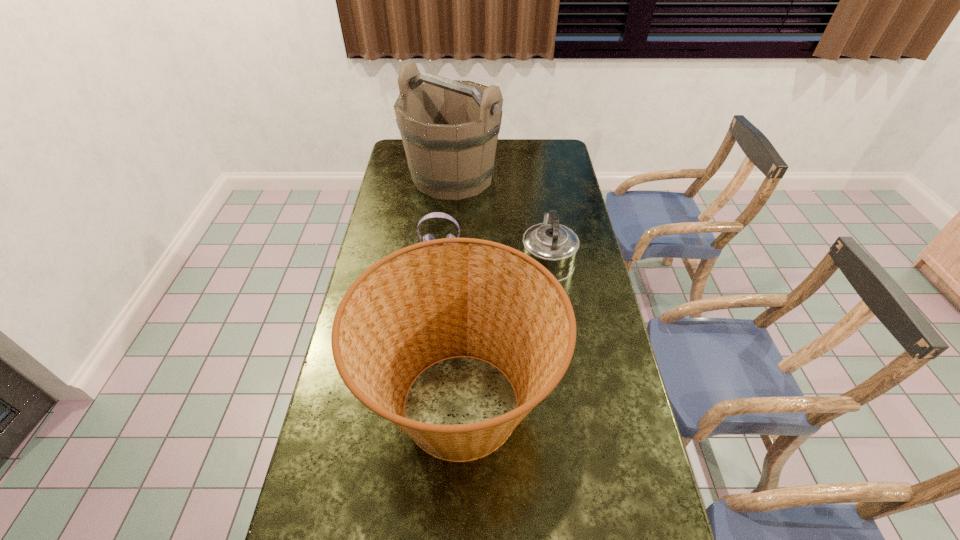
At what (x,y) coordinates should I click in order to perform the action: click on free point located with the spout at the front of the third tallest object. Please return your answer as a coordinate pair (x, y). The height and width of the screenshot is (540, 960). Looking at the image, I should click on (540, 208).

The width and height of the screenshot is (960, 540). I want to click on vacant space situated 0.180m on the headband and ear cups of the shortest object, so click(436, 294).

You are a GUI agent. You are given a task and a screenshot of the screen. Output one action in this format:
    pyautogui.click(x=<x>, y=<y>)
    Task: Click on the object located at the far edge
    This screenshot has width=960, height=540.
    Given the screenshot: What is the action you would take?
    pyautogui.click(x=449, y=128)

Locate an element on the screen. bucket that is at the left edge is located at coordinates (449, 128).

The image size is (960, 540). What are the coordinates of `basket that is at the left edge` in the screenshot? It's located at (491, 302).

Image resolution: width=960 pixels, height=540 pixels. I want to click on object located in the right edge section of the desktop, so click(555, 246).

Locate an element on the screen. The width and height of the screenshot is (960, 540). object present at the far left corner is located at coordinates (449, 128).

Identify the location of vacant area at the left edge. The height and width of the screenshot is (540, 960). (319, 516).

I want to click on blank area at the right edge, so click(592, 323).

In the image, there is a desktop. Identify the location of vacant space at the far right corner. Image resolution: width=960 pixels, height=540 pixels. (542, 159).